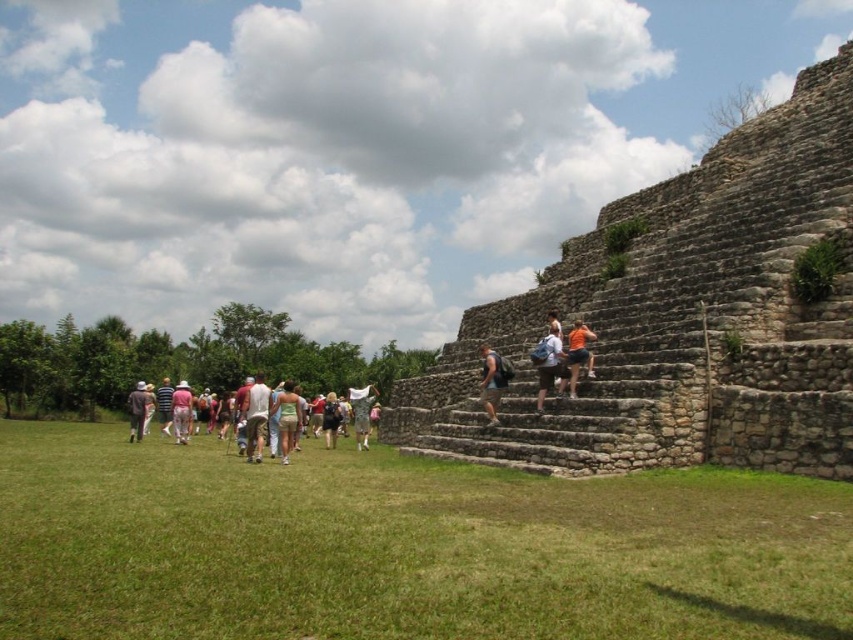
You are a photographer planning to take a picture of the archaeological site. You notice two people wearing a green fabric dress at center and a camouflage fabric at center. Which clothing item would appear larger in the photo if the photographer wants to emphasize the width of the garments?

The green fabric dress at center might be wider than camouflage fabric at center, so it would appear larger in the photo if the photographer wants to emphasize the width of the garments.

You are standing at the archaeological site and want to take a photo of the white cotton dress at center. If your camera has a maximum focus range of 50 meters, will you be able to capture the dress clearly?

The white cotton dress at center is 52.71 meters away from the viewer, which exceeds the camera maximum focus range of 50 meters. Therefore, the viewer will not be able to capture the dress clearly.

You are a photographer standing at the base of the pyramid. You want to take a photo of the white cotton dress at center and the pink cotton pants at center so that both are clearly visible. Which object should you ensure is not blocking the other?

The white cotton dress at center is in front of the pink cotton pants at center, so you should ensure that the white cotton dress at center is not blocking the pink cotton pants at center.